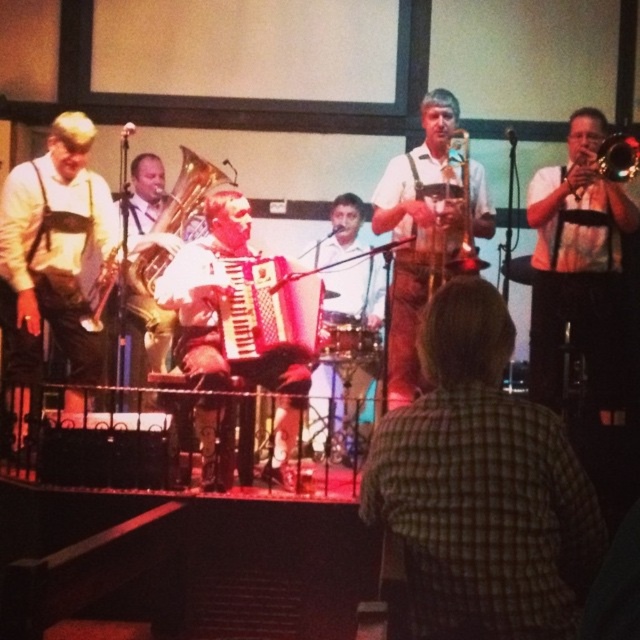
Question: Which of the following is the farthest from the observer?

Choices:
 (A) matte white shirt at center
 (B) white textured accordion at center

Answer: (B)

Question: Does white tie-dye shirt at right appear on the right side of white textured accordion at center?

Choices:
 (A) yes
 (B) no

Answer: (A)

Question: Which of the following is the closest to the observer?

Choices:
 (A) white fabric drum at center
 (B) wooden saxophone at center

Answer: (B)

Question: Can you confirm if green plaid shirt at center is wider than gold brass trumpet at upper right?

Choices:
 (A) no
 (B) yes

Answer: (B)

Question: Can you confirm if white leather pants at center is positioned above white fabric drum at center?

Choices:
 (A) no
 (B) yes

Answer: (B)

Question: Which point is farther to the camera?

Choices:
 (A) matte white shirt at center
 (B) green plaid shirt at center

Answer: (A)